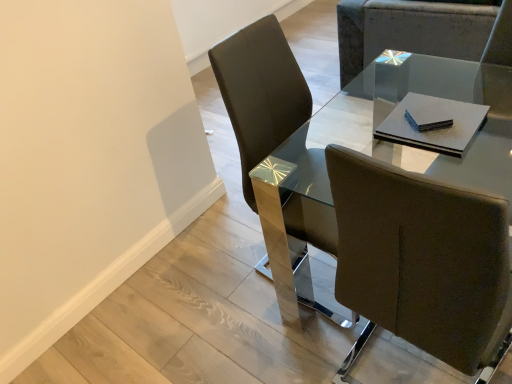
Question: From a real-world perspective, is brown leather chair at center, which ranks as the 2th chair in top-to-bottom order, physically located above or below matte brown chair at upper right, which is counted as the 2th chair, starting from the bottom?

Choices:
 (A) above
 (B) below

Answer: (A)

Question: Is brown leather chair at center, the first chair when ordered from bottom to top, spatially inside matte brown chair at upper right, which is the 1th chair from top to bottom, or outside of it?

Choices:
 (A) inside
 (B) outside

Answer: (B)

Question: Which is farther from the glass/metal table at center?

Choices:
 (A) brown leather chair at center, the second chair when ordered from back to front
 (B) matte brown chair at upper right, which is counted as the 1th chair, starting from the back

Answer: (A)

Question: Which object is the closest to the brown leather chair at center, the first chair when ordered from left to right?

Choices:
 (A) glass/metal table at center
 (B) matte brown chair at upper right, which is the 2th chair from front to back

Answer: (A)